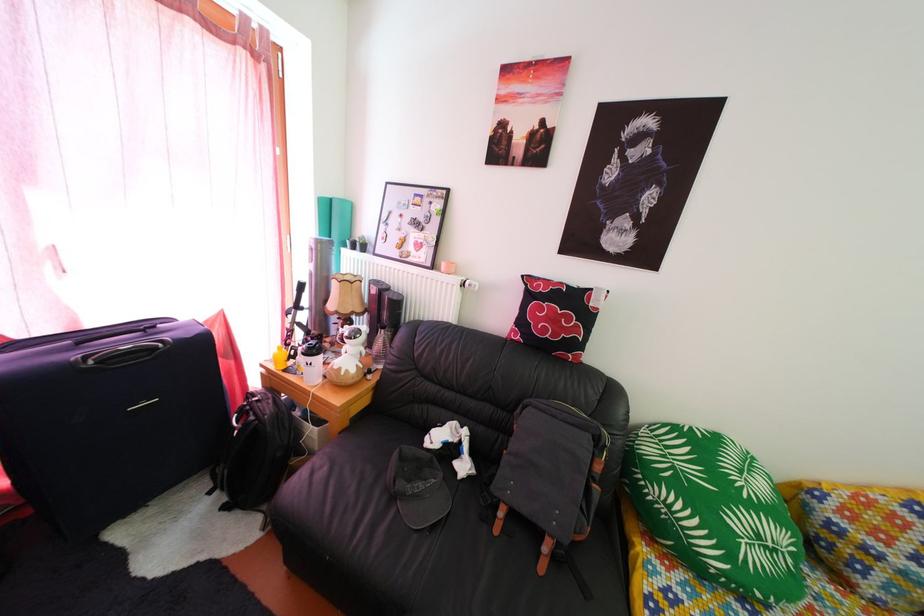
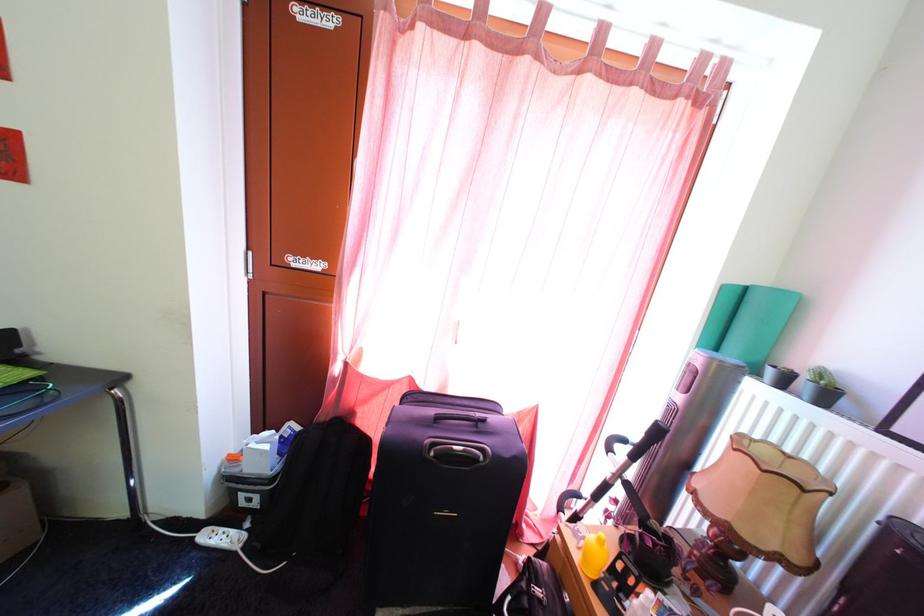
Locate, in the second image, the point that corresponds to pixel 360 292 in the first image.

(812, 499)